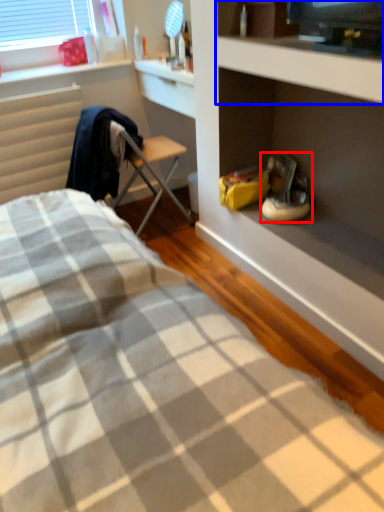
Question: Which object appears farthest to the camera in this image, footwear (highlighted by a red box) or cabinet (highlighted by a blue box)?

Choices:
 (A) footwear
 (B) cabinet

Answer: (A)